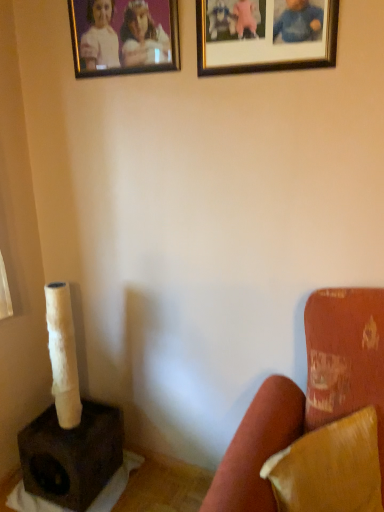
This screenshot has width=384, height=512. I want to click on gold-framed picture at upper center, acting as the first picture frame starting from the right, so click(265, 35).

You are a GUI agent. You are given a task and a screenshot of the screen. Output one action in this format:
    pyautogui.click(x=<x>, y=<y>)
    Task: Click on the dark brown matte speaker at lower left
    
    Given the screenshot: What is the action you would take?
    (x=72, y=455)

Measure the distance between gold-framed photo at upper center, the second picture frame in the right-to-left sequence, and camera.

4.69 feet.

Locate an element on the screen. Image resolution: width=384 pixels, height=512 pixels. velvet red armchair at lower right is located at coordinates (316, 420).

Can you confirm if leather-like brown pillow at lower right is wider than velvet red armchair at lower right?

No.

Is leather-like brown pillow at lower right to the left or to the right of velvet red armchair at lower right in the image?

leather-like brown pillow at lower right is to the right of velvet red armchair at lower right.

Considering the sizes of objects leather-like brown pillow at lower right and velvet red armchair at lower right in the image provided, who is shorter, leather-like brown pillow at lower right or velvet red armchair at lower right?

With less height is leather-like brown pillow at lower right.

Which is more to the right, gold-framed picture at upper center, the 2th picture frame when ordered from left to right, or velvet red armchair at lower right?

velvet red armchair at lower right.

Does point (232, 26) lie behind point (307, 384)?

Yes, it is behind point (307, 384).

Identify the location of pillow in front of the dark brown matte speaker at lower left. (330, 468).

Is dark brown matte speaker at lower left in front of or behind leather-like brown pillow at lower right in the image?

Clearly, dark brown matte speaker at lower left is behind leather-like brown pillow at lower right.

From a real-world perspective, is dark brown matte speaker at lower left positioned under leather-like brown pillow at lower right based on gravity?

Indeed, from a real-world perspective, dark brown matte speaker at lower left is positioned beneath leather-like brown pillow at lower right.

Which of these two, gold-framed picture at upper center, the 2th picture frame when ordered from left to right, or dark brown matte speaker at lower left, stands shorter?

Standing shorter between the two is dark brown matte speaker at lower left.

Are gold-framed picture at upper center, the 2th picture frame when ordered from left to right, and dark brown matte speaker at lower left beside each other?

No.

Between gold-framed picture at upper center, the 2th picture frame when ordered from left to right, and dark brown matte speaker at lower left, which one is positioned behind?

dark brown matte speaker at lower left is behind.

Between leather-like brown pillow at lower right and gold-framed picture at upper center, the 2th picture frame when ordered from left to right, which one has larger size?

With larger size is leather-like brown pillow at lower right.

From the image's perspective, is leather-like brown pillow at lower right located beneath gold-framed picture at upper center, the 2th picture frame when ordered from left to right?

Correct, leather-like brown pillow at lower right appears lower than gold-framed picture at upper center, the 2th picture frame when ordered from left to right, in the image.

Based on the photo, is leather-like brown pillow at lower right not within gold-framed picture at upper center, the 2th picture frame when ordered from left to right?

Absolutely, leather-like brown pillow at lower right is external to gold-framed picture at upper center, the 2th picture frame when ordered from left to right.

Is velvet red armchair at lower right not near gold-framed picture at upper center, acting as the first picture frame starting from the right?

velvet red armchair at lower right is near gold-framed picture at upper center, acting as the first picture frame starting from the right, not far away.

Is velvet red armchair at lower right to the left or to the right of gold-framed picture at upper center, the 2th picture frame when ordered from left to right, in the image?

From the image, it's evident that velvet red armchair at lower right is to the right of gold-framed picture at upper center, the 2th picture frame when ordered from left to right.

Which point is more distant from viewer, (335, 316) or (269, 12)?

Positioned behind is point (269, 12).

Does velvet red armchair at lower right have a larger size compared to gold-framed picture at upper center, the 2th picture frame when ordered from left to right?

Correct, velvet red armchair at lower right is larger in size than gold-framed picture at upper center, the 2th picture frame when ordered from left to right.

From the image's perspective, which is below, gold-framed photo at upper center, which ranks as the first picture frame in left-to-right order, or gold-framed picture at upper center, acting as the first picture frame starting from the right?

gold-framed picture at upper center, acting as the first picture frame starting from the right.

Choose the correct answer: Is gold-framed photo at upper center, which ranks as the first picture frame in left-to-right order, inside gold-framed picture at upper center, the 2th picture frame when ordered from left to right, or outside it?

gold-framed photo at upper center, which ranks as the first picture frame in left-to-right order, is not enclosed by gold-framed picture at upper center, the 2th picture frame when ordered from left to right.

Looking at the image, does gold-framed photo at upper center, the second picture frame in the right-to-left sequence, seem bigger or smaller compared to gold-framed picture at upper center, the 2th picture frame when ordered from left to right?

Clearly, gold-framed photo at upper center, the second picture frame in the right-to-left sequence, is larger in size than gold-framed picture at upper center, the 2th picture frame when ordered from left to right.

Can you confirm if gold-framed photo at upper center, which ranks as the first picture frame in left-to-right order, is taller than gold-framed picture at upper center, acting as the first picture frame starting from the right?

No, gold-framed photo at upper center, which ranks as the first picture frame in left-to-right order, is not taller than gold-framed picture at upper center, acting as the first picture frame starting from the right.

At what (x,y) coordinates should I click in order to perform the action: click on pillow above the velvet red armchair at lower right (from a real-world perspective). Please return your answer as a coordinate pair (x, y). This screenshot has height=512, width=384. Looking at the image, I should click on (330, 468).

The image size is (384, 512). What are the coordinates of `furniture in front of the gold-framed picture at upper center, acting as the first picture frame starting from the right` in the screenshot? It's located at (316, 420).

Looking at the image, which one is located closer to dark brown matte speaker at lower left, velvet red armchair at lower right or gold-framed photo at upper center, which ranks as the first picture frame in left-to-right order?

velvet red armchair at lower right lies closer to dark brown matte speaker at lower left than the other object.

From the image, which object appears to be nearer to gold-framed picture at upper center, acting as the first picture frame starting from the right, dark brown matte speaker at lower left or velvet red armchair at lower right?

Based on the image, velvet red armchair at lower right appears to be nearer to gold-framed picture at upper center, acting as the first picture frame starting from the right.

Looking at the image, which one is located closer to leather-like brown pillow at lower right, dark brown matte speaker at lower left or gold-framed picture at upper center, the 2th picture frame when ordered from left to right?

The object closer to leather-like brown pillow at lower right is dark brown matte speaker at lower left.

When comparing their distances from leather-like brown pillow at lower right, does gold-framed photo at upper center, which ranks as the first picture frame in left-to-right order, or gold-framed picture at upper center, the 2th picture frame when ordered from left to right, seem closer?

The object closer to leather-like brown pillow at lower right is gold-framed picture at upper center, the 2th picture frame when ordered from left to right.

Which object lies further to the anchor point gold-framed photo at upper center, which ranks as the first picture frame in left-to-right order, dark brown matte speaker at lower left or velvet red armchair at lower right?

dark brown matte speaker at lower left is positioned further to the anchor gold-framed photo at upper center, which ranks as the first picture frame in left-to-right order.

Considering their positions, is leather-like brown pillow at lower right positioned closer to gold-framed photo at upper center, which ranks as the first picture frame in left-to-right order, than gold-framed picture at upper center, the 2th picture frame when ordered from left to right?

gold-framed picture at upper center, the 2th picture frame when ordered from left to right, is closer to gold-framed photo at upper center, which ranks as the first picture frame in left-to-right order.

Looking at the image, which one is located closer to gold-framed picture at upper center, the 2th picture frame when ordered from left to right, leather-like brown pillow at lower right or dark brown matte speaker at lower left?

Based on the image, leather-like brown pillow at lower right appears to be nearer to gold-framed picture at upper center, the 2th picture frame when ordered from left to right.

Which object lies further to the anchor point gold-framed picture at upper center, acting as the first picture frame starting from the right, leather-like brown pillow at lower right or gold-framed photo at upper center, the second picture frame in the right-to-left sequence?

Among the two, leather-like brown pillow at lower right is located further to gold-framed picture at upper center, acting as the first picture frame starting from the right.

The width and height of the screenshot is (384, 512). I want to click on furniture between gold-framed picture at upper center, the 2th picture frame when ordered from left to right, and dark brown matte speaker at lower left from top to bottom, so click(x=316, y=420).

The height and width of the screenshot is (512, 384). What are the coordinates of `pillow that lies between gold-framed photo at upper center, the second picture frame in the right-to-left sequence, and velvet red armchair at lower right from top to bottom` in the screenshot? It's located at (330, 468).

The width and height of the screenshot is (384, 512). I want to click on pillow between gold-framed picture at upper center, acting as the first picture frame starting from the right, and dark brown matte speaker at lower left vertically, so click(x=330, y=468).

You are a GUI agent. You are given a task and a screenshot of the screen. Output one action in this format:
    pyautogui.click(x=<x>, y=<y>)
    Task: Click on the picture frame between gold-framed photo at upper center, the second picture frame in the right-to-left sequence, and dark brown matte speaker at lower left from top to bottom
    
    Given the screenshot: What is the action you would take?
    pyautogui.click(x=265, y=35)